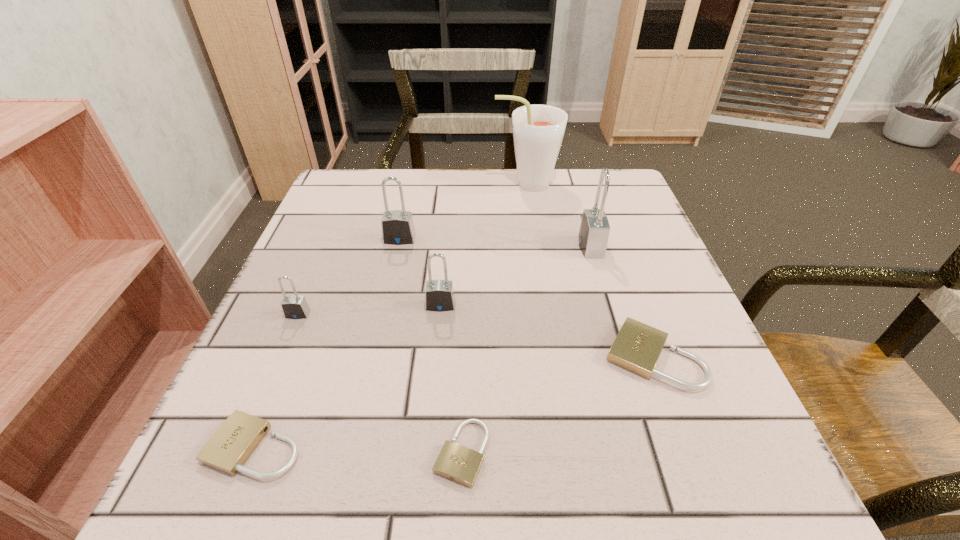
Identify the location of free location that satisfies the following two spatial constraints: 1. on the drink side of the tallest object; 2. on the shackle of the smallest gray padlock. tap(545, 314).

This screenshot has width=960, height=540. Identify the location of free spot that satisfies the following two spatial constraints: 1. on the back side of the shortest object; 2. on the right side of the third nearest object. (465, 356).